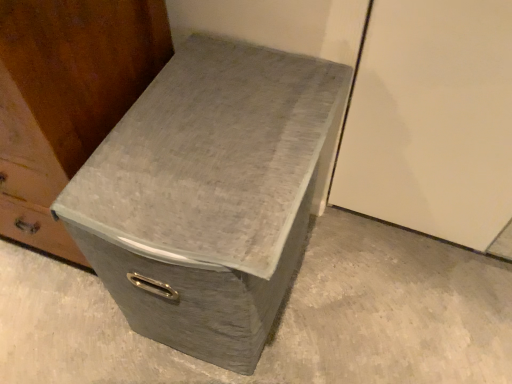
Question: From a real-world perspective, is matte gray storage box at center physically located above or below gray fabric shoe box at center?

Choices:
 (A) above
 (B) below

Answer: (A)

Question: Looking at their shapes, would you say matte gray storage box at center is wider or thinner than gray fabric shoe box at center?

Choices:
 (A) thin
 (B) wide

Answer: (A)

Question: Based on their relative distances, which object is nearer to the matte gray storage box at center?

Choices:
 (A) gray fabric shoe box at center
 (B) gray fabric storage bin at center

Answer: (A)

Question: Which object is positioned farthest from the matte gray storage box at center?

Choices:
 (A) gray fabric storage bin at center
 (B) gray fabric shoe box at center

Answer: (A)